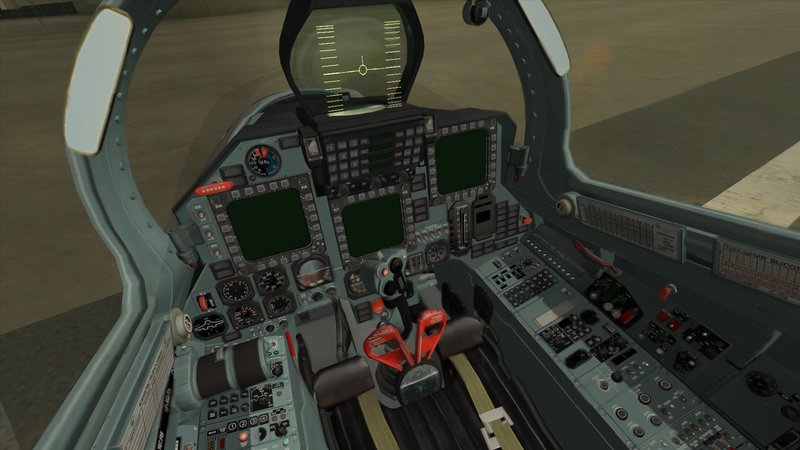
Locate an element on the screen. The image size is (800, 450). right window is located at coordinates (685, 116).